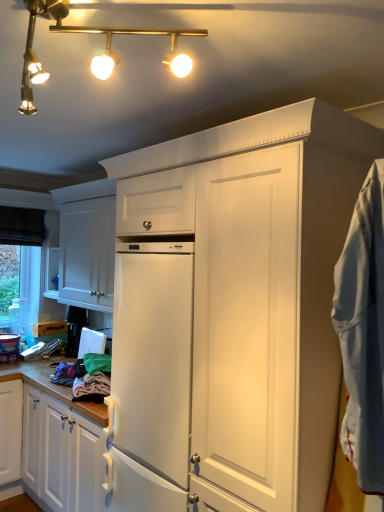
Question: From the image's perspective, is white matte cabinet at upper left above gold metallic track lights at upper left?

Choices:
 (A) no
 (B) yes

Answer: (A)

Question: From a real-world perspective, is white matte cabinet at upper left located beneath gold metallic track lights at upper left?

Choices:
 (A) no
 (B) yes

Answer: (B)

Question: From the image's perspective, does white matte cabinet at upper left appear lower than gold metallic track lights at upper left?

Choices:
 (A) yes
 (B) no

Answer: (A)

Question: Is white matte cabinet at upper left to the left of gold metallic track lights at upper left from the viewer's perspective?

Choices:
 (A) no
 (B) yes

Answer: (B)

Question: Is white matte cabinet at upper left oriented towards gold metallic track lights at upper left?

Choices:
 (A) yes
 (B) no

Answer: (B)

Question: Does white matte cabinet at upper left have a larger size compared to gold metallic track lights at upper left?

Choices:
 (A) no
 (B) yes

Answer: (B)

Question: Is white cotton blanket at right bigger than white matte cabinet at upper left?

Choices:
 (A) yes
 (B) no

Answer: (B)

Question: Could you tell me if white cotton blanket at right is facing white matte cabinet at upper left?

Choices:
 (A) yes
 (B) no

Answer: (B)

Question: Is the position of white cotton blanket at right less distant than that of white matte cabinet at upper left?

Choices:
 (A) yes
 (B) no

Answer: (A)

Question: Is white matte cabinet at upper left located within white cotton blanket at right?

Choices:
 (A) no
 (B) yes

Answer: (A)

Question: From the image's perspective, is white cotton blanket at right beneath white matte cabinet at upper left?

Choices:
 (A) yes
 (B) no

Answer: (A)

Question: From a real-world perspective, is white cotton blanket at right physically below white matte cabinet at upper left?

Choices:
 (A) no
 (B) yes

Answer: (B)

Question: From the image's perspective, is gold metallic track lights at upper left on top of white matte cabinet at upper left?

Choices:
 (A) yes
 (B) no

Answer: (A)